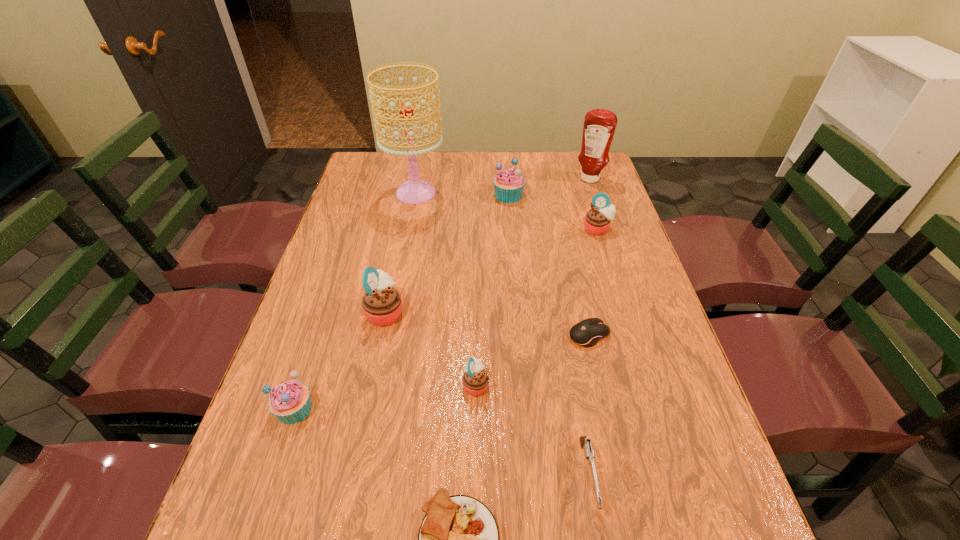
Identify the location of free point between the computer mouse and the rightmost pink muffin. This screenshot has width=960, height=540. (593, 282).

Where is `vacant space in between the fourth farthest object and the pistol`? vacant space in between the fourth farthest object and the pistol is located at coordinates (592, 353).

Where is `free space between the biggest pink muffin and the tallest object`? The image size is (960, 540). free space between the biggest pink muffin and the tallest object is located at coordinates (400, 253).

Locate an element on the screen. The width and height of the screenshot is (960, 540). object that stands as the ninth closest to the second farthest pink muffin is located at coordinates (599, 126).

The width and height of the screenshot is (960, 540). I want to click on object that stands as the sixth closest to the ninth shortest object, so click(475, 380).

What are the coordinates of `muffin that is the second closest to the left blue muffin` in the screenshot? It's located at (475, 380).

Identify the location of muffin that stands as the second closest to the eighth tallest object. (381, 304).

I want to click on pink muffin that is the second closest to the lampshade, so click(597, 221).

Where is `the closest pink muffin to the fourth farthest object`? the closest pink muffin to the fourth farthest object is located at coordinates (475, 380).

You are a GUI agent. You are given a task and a screenshot of the screen. Output one action in this format:
    pyautogui.click(x=<x>, y=<y>)
    Task: Click on the blank space that satisfies the following two spatial constraints: 1. on the front-facing side of the third muffin from right to left; 2. on the front side of the leftmost muffin
    The height and width of the screenshot is (540, 960).
    Given the screenshot: What is the action you would take?
    pyautogui.click(x=475, y=409)